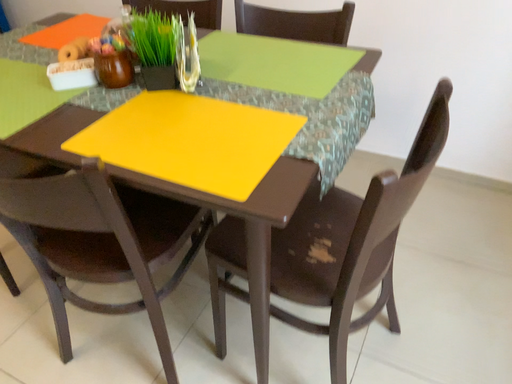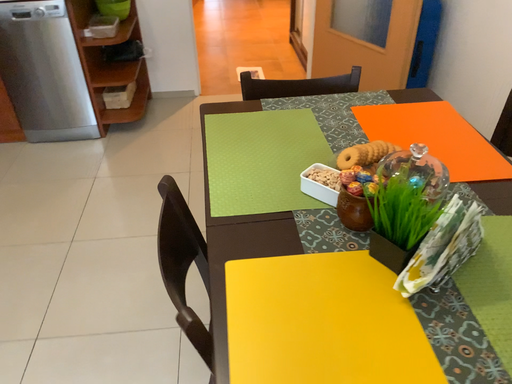
Question: Which way did the camera rotate in the video?

Choices:
 (A) rotated right
 (B) rotated left

Answer: (B)